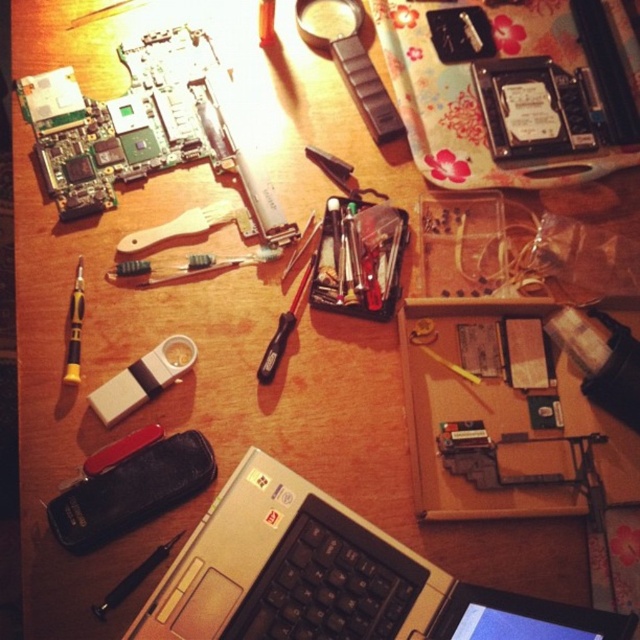
Question: Among these objects, which one is nearest to the camera?

Choices:
 (A) silver metallic laptop at center
 (B) wooden-handled screwdriver at center-left
 (C) white plastic usb flash drive at center-left
 (D) gold-plated screwdriver at left

Answer: (A)

Question: Is black plastic swiss army knife at lower left to the left of wooden-handled screwdriver at center-left from the viewer's perspective?

Choices:
 (A) no
 (B) yes

Answer: (B)

Question: Does black plastic swiss army knife at lower left appear on the right side of white plastic usb flash drive at center-left?

Choices:
 (A) no
 (B) yes

Answer: (B)

Question: Which of the following is the farthest from the observer?

Choices:
 (A) silver metallic laptop at center
 (B) transparent plastic magnifying glass at upper center
 (C) black plastic screwdriver at center

Answer: (B)

Question: Does wooden-handled screwdriver at center-left have a smaller size compared to translucent plastic ruler at center?

Choices:
 (A) no
 (B) yes

Answer: (A)

Question: Which of the following is the farthest from the observer?

Choices:
 (A) (116, 497)
 (B) (102, 605)
 (C) (188, 272)
 (D) (272, 36)

Answer: (D)